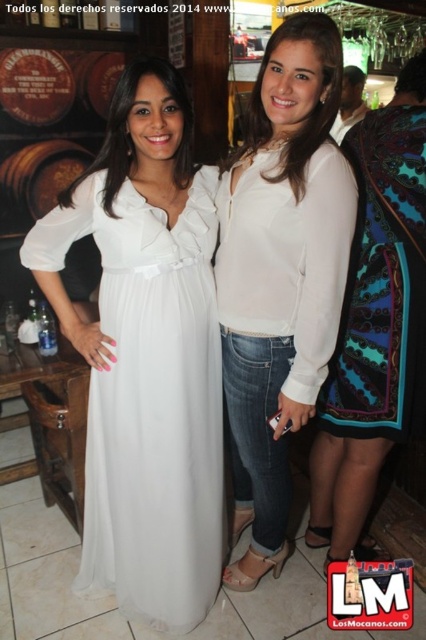
Is white matte blouse at center thinner than patterned silk dress at right?

Incorrect, white matte blouse at center's width is not less than patterned silk dress at right's.

Which is above, white matte blouse at center or patterned silk dress at right?

patterned silk dress at right is above.

At what (x,y) coordinates should I click in order to perform the action: click on white matte blouse at center. Please return your answer as a coordinate pair (x, y). Looking at the image, I should click on (281, 273).

Which of these two, white sheer dress at center or white matte blouse at center, stands taller?

Standing taller between the two is white matte blouse at center.

Does white sheer dress at center have a greater height compared to white matte blouse at center?

In fact, white sheer dress at center may be shorter than white matte blouse at center.

Is point (198, 292) closer to viewer compared to point (262, 113)?

No, it is not.

The width and height of the screenshot is (426, 640). I want to click on white sheer dress at center, so click(149, 400).

Is point (192, 300) behind point (377, 113)?

No.

Which is behind, point (109, 413) or point (360, 205)?

Point (360, 205)

Is point (126, 394) positioned after point (397, 147)?

That is True.

Find the location of a particular element. The width and height of the screenshot is (426, 640). white sheer dress at center is located at coordinates (149, 400).